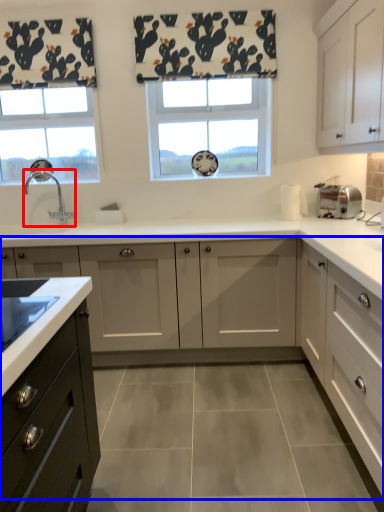
Question: Among these objects, which one is farthest to the camera, tap (highlighted by a red box) or cabinetry (highlighted by a blue box)?

Choices:
 (A) tap
 (B) cabinetry

Answer: (A)